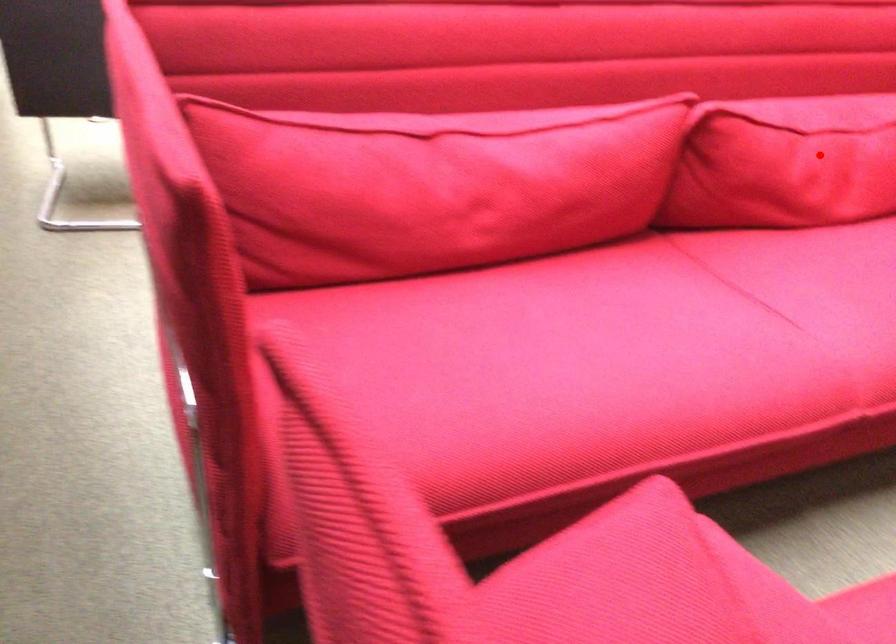
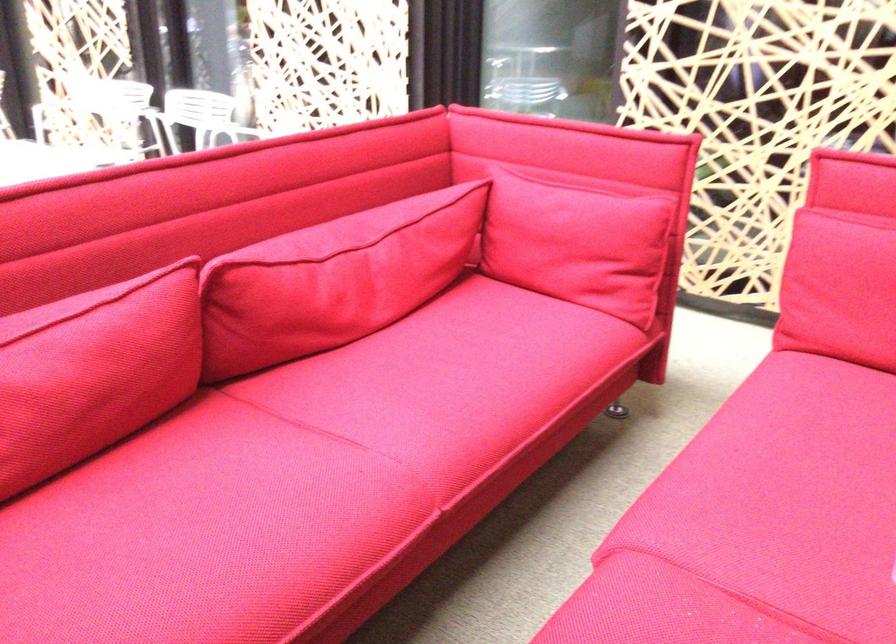
In the second image, find the point that corresponds to the highlighted location in the first image.

(332, 279)